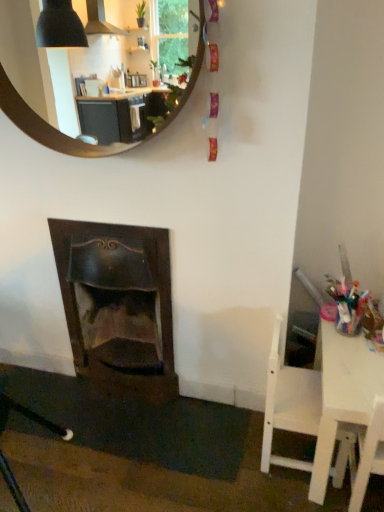
Question: From a real-world perspective, is white wood chair at lower right physically located above or below dark wood fireplace at lower left?

Choices:
 (A) above
 (B) below

Answer: (B)

Question: Considering the positions of white wood chair at lower right and dark wood fireplace at lower left in the image, is white wood chair at lower right taller or shorter than dark wood fireplace at lower left?

Choices:
 (A) short
 (B) tall

Answer: (A)

Question: Which is nearer to the wooden round mirror at upper center?

Choices:
 (A) dark wood fireplace at lower left
 (B) white plastic table at right
 (C) white wood chair at lower right

Answer: (A)

Question: Estimate the real-world distances between objects in this image. Which object is closer to the white plastic table at right?

Choices:
 (A) dark wood fireplace at lower left
 (B) wooden round mirror at upper center
 (C) white wood chair at lower right

Answer: (C)